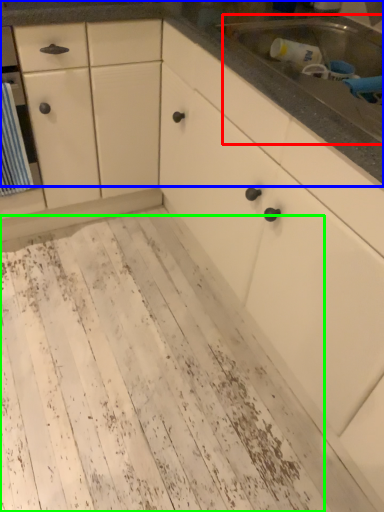
Question: Considering the real-world distances, which object is farthest from sink (highlighted by a red box)? countertop (highlighted by a blue box) or mud (highlighted by a green box)?

Choices:
 (A) countertop
 (B) mud

Answer: (B)